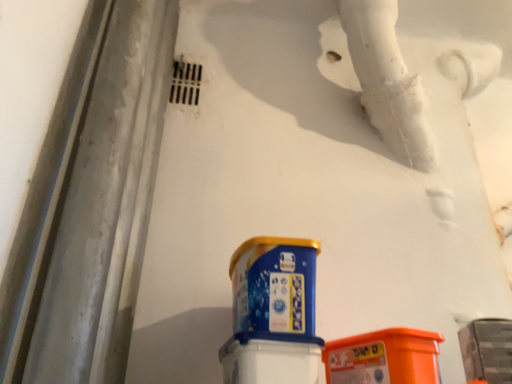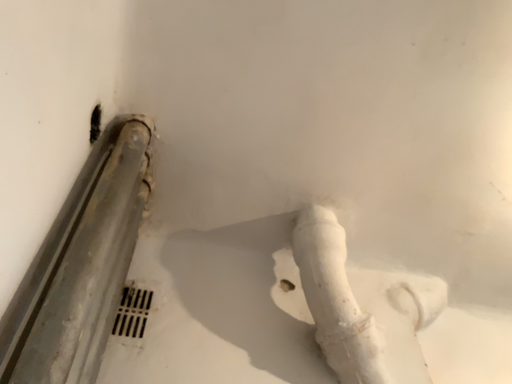
Question: Which way did the camera rotate in the video?

Choices:
 (A) rotated upward
 (B) rotated downward

Answer: (A)